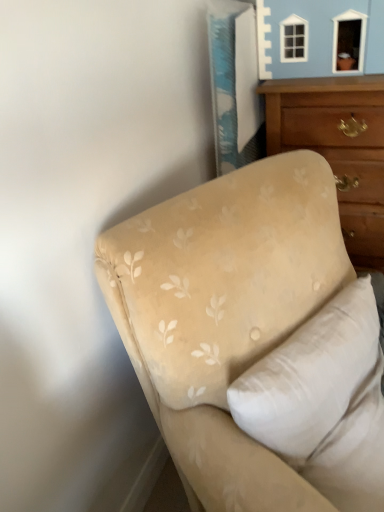
Question: Can you confirm if beige fabric couch at lower right is thinner than beige fabric pillow at upper right?

Choices:
 (A) no
 (B) yes

Answer: (A)

Question: From a real-world perspective, is beige fabric couch at lower right positioned over beige fabric pillow at upper right based on gravity?

Choices:
 (A) yes
 (B) no

Answer: (B)

Question: Are beige fabric couch at lower right and beige fabric pillow at upper right far apart?

Choices:
 (A) yes
 (B) no

Answer: (B)

Question: Is beige fabric couch at lower right completely or partially outside of beige fabric pillow at upper right?

Choices:
 (A) yes
 (B) no

Answer: (A)

Question: Can you confirm if beige fabric couch at lower right is taller than beige fabric pillow at upper right?

Choices:
 (A) no
 (B) yes

Answer: (B)

Question: Is beige fabric pillow at upper right completely or partially inside beige fabric couch at lower right?

Choices:
 (A) no
 (B) yes

Answer: (B)

Question: From a real-world perspective, is beige fabric pillow at upper right located higher than wooden chest of drawers at upper right?

Choices:
 (A) yes
 (B) no

Answer: (A)

Question: Does beige fabric pillow at upper right have a greater height compared to wooden chest of drawers at upper right?

Choices:
 (A) no
 (B) yes

Answer: (A)

Question: From a real-world perspective, is beige fabric pillow at upper right physically below wooden chest of drawers at upper right?

Choices:
 (A) no
 (B) yes

Answer: (A)

Question: Does beige fabric pillow at upper right appear on the left side of wooden chest of drawers at upper right?

Choices:
 (A) no
 (B) yes

Answer: (B)

Question: Is beige fabric pillow at upper right not inside wooden chest of drawers at upper right?

Choices:
 (A) yes
 (B) no

Answer: (A)

Question: Can you confirm if beige fabric pillow at upper right is smaller than wooden chest of drawers at upper right?

Choices:
 (A) no
 (B) yes

Answer: (B)

Question: Can you confirm if wooden chest of drawers at upper right is wider than beige fabric pillow at upper right?

Choices:
 (A) yes
 (B) no

Answer: (A)